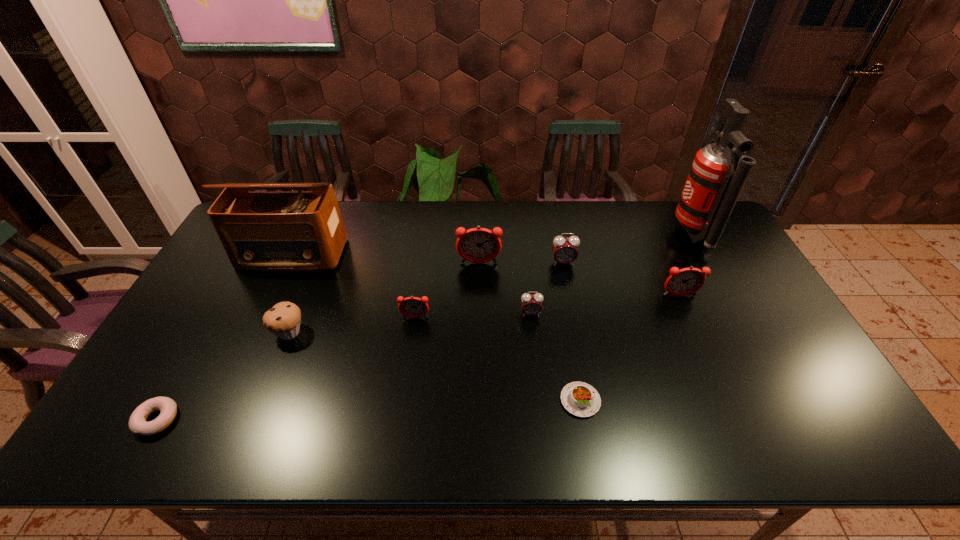
You are a GUI agent. You are given a task and a screenshot of the screen. Output one action in this format:
    pyautogui.click(x=<x>, y=<y>)
    Task: Click on the fifth object from right to left
    This screenshot has width=960, height=540.
    Given the screenshot: What is the action you would take?
    pyautogui.click(x=531, y=304)

I want to click on the smaller pink alarm clock, so [x=531, y=304].

Where is `the leftmost alarm clock`? the leftmost alarm clock is located at coordinates (413, 307).

Locate an element on the screen. This screenshot has height=540, width=960. the fourth object from left to right is located at coordinates (413, 307).

The image size is (960, 540). Identify the location of pudding. (580, 399).

This screenshot has width=960, height=540. Find the location of `brown doughnut`. brown doughnut is located at coordinates (138, 425).

Find the location of a particular element. The width and height of the screenshot is (960, 540). free spot located on the front label side of the rightmost object is located at coordinates (618, 234).

At what (x,y) coordinates should I click in order to perform the action: click on vacant space located 0.270m on the front label side of the rightmost object. Please return your answer as a coordinate pair (x, y). Looking at the image, I should click on (595, 234).

Image resolution: width=960 pixels, height=540 pixels. What are the coordinates of `vacant region located on the front label side of the rightmost object` in the screenshot? It's located at (592, 234).

Locate an element on the screen. This screenshot has height=540, width=960. vacant point located 0.050m on the front panel of the ninth shortest object is located at coordinates (277, 285).